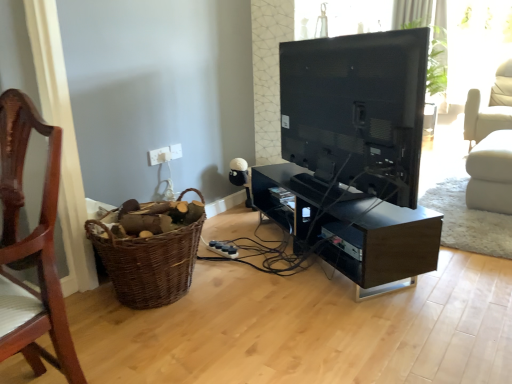
Question: Is black glossy tv stand at center not close to brown woven basket at lower left?

Choices:
 (A) no
 (B) yes

Answer: (A)

Question: Considering the relative positions of black glossy tv stand at center and brown woven basket at lower left in the image provided, is black glossy tv stand at center to the right of brown woven basket at lower left from the viewer's perspective?

Choices:
 (A) no
 (B) yes

Answer: (B)

Question: Is the depth of black glossy tv stand at center greater than that of brown woven basket at lower left?

Choices:
 (A) yes
 (B) no

Answer: (A)

Question: Does black glossy tv stand at center appear on the left side of brown woven basket at lower left?

Choices:
 (A) no
 (B) yes

Answer: (A)

Question: From the image's perspective, would you say black glossy tv stand at center is positioned over brown woven basket at lower left?

Choices:
 (A) no
 (B) yes

Answer: (B)

Question: In terms of height, does white plastic electric outlet at lower center, arranged as the second electric outlet when viewed from the right, look taller or shorter compared to white plastic electric outlet at upper center, marked as the first electric outlet in a right-to-left arrangement?

Choices:
 (A) short
 (B) tall

Answer: (B)

Question: Considering their positions, is white plastic electric outlet at lower center, arranged as the second electric outlet when viewed from the right, located in front of or behind white plastic electric outlet at upper center, marked as the first electric outlet in a right-to-left arrangement?

Choices:
 (A) front
 (B) behind

Answer: (A)

Question: Based on their sizes in the image, would you say white plastic electric outlet at lower center, the first electric outlet in the left-to-right sequence, is bigger or smaller than white plastic electric outlet at upper center, marked as the first electric outlet in a right-to-left arrangement?

Choices:
 (A) small
 (B) big

Answer: (B)

Question: From the image's perspective, is white plastic electric outlet at lower center, the first electric outlet in the left-to-right sequence, above or below white plastic electric outlet at upper center, marked as the first electric outlet in a right-to-left arrangement?

Choices:
 (A) below
 (B) above

Answer: (A)

Question: Looking at their shapes, would you say white plastic electric outlet at lower center, arranged as the second electric outlet when viewed from the right, is wider or thinner than brown woven basket at lower left?

Choices:
 (A) wide
 (B) thin

Answer: (B)

Question: From the image's perspective, is white plastic electric outlet at lower center, arranged as the second electric outlet when viewed from the right, positioned above or below brown woven basket at lower left?

Choices:
 (A) above
 (B) below

Answer: (A)

Question: From a real-world perspective, is white plastic electric outlet at lower center, arranged as the second electric outlet when viewed from the right, positioned above or below brown woven basket at lower left?

Choices:
 (A) above
 (B) below

Answer: (A)

Question: In terms of size, does white plastic electric outlet at lower center, the first electric outlet in the left-to-right sequence, appear bigger or smaller than brown woven basket at lower left?

Choices:
 (A) small
 (B) big

Answer: (A)

Question: In terms of width, does matte black tv at center look wider or thinner when compared to white plastic electric outlet at upper center, arranged as the 2th electric outlet when viewed from the left?

Choices:
 (A) wide
 (B) thin

Answer: (A)

Question: Is matte black tv at center bigger or smaller than white plastic electric outlet at upper center, arranged as the 2th electric outlet when viewed from the left?

Choices:
 (A) small
 (B) big

Answer: (B)